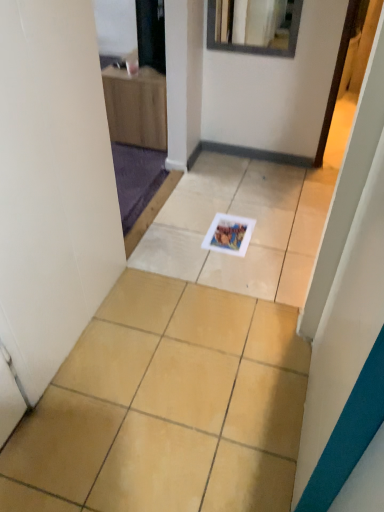
You are a GUI agent. You are given a task and a screenshot of the screen. Output one action in this format:
    pyautogui.click(x=<x>, y=<y>)
    Task: Click on the vacant space to the right of white glossy magazine at center
    This screenshot has width=384, height=512.
    Given the screenshot: What is the action you would take?
    pyautogui.click(x=281, y=242)